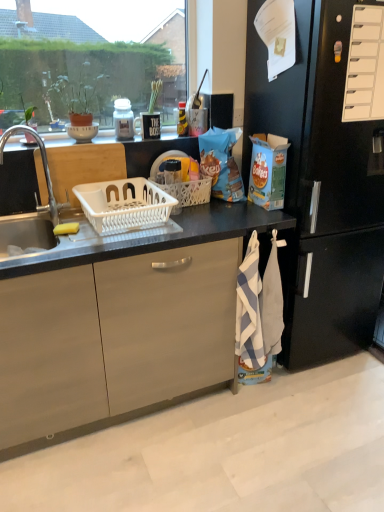
Question: Could you tell me if silver metallic sink at left is facing blue striped towel at lower right?

Choices:
 (A) no
 (B) yes

Answer: (A)

Question: Considering the relative sizes of silver metallic sink at left and blue striped towel at lower right in the image provided, is silver metallic sink at left taller than blue striped towel at lower right?

Choices:
 (A) yes
 (B) no

Answer: (B)

Question: Considering the relative sizes of silver metallic sink at left and blue striped towel at lower right in the image provided, is silver metallic sink at left thinner than blue striped towel at lower right?

Choices:
 (A) no
 (B) yes

Answer: (A)

Question: Can you see silver metallic sink at left touching blue striped towel at lower right?

Choices:
 (A) yes
 (B) no

Answer: (B)

Question: Does silver metallic sink at left lie behind blue striped towel at lower right?

Choices:
 (A) no
 (B) yes

Answer: (A)

Question: Relative to clear glass window at upper left, is blue striped towel at lower right in front or behind?

Choices:
 (A) behind
 (B) front

Answer: (B)

Question: In the image, is blue striped towel at lower right on the left side or the right side of clear glass window at upper left?

Choices:
 (A) left
 (B) right

Answer: (B)

Question: From the image's perspective, is blue striped towel at lower right above or below clear glass window at upper left?

Choices:
 (A) below
 (B) above

Answer: (A)

Question: Based on their sizes in the image, would you say blue striped towel at lower right is bigger or smaller than clear glass window at upper left?

Choices:
 (A) big
 (B) small

Answer: (B)

Question: Looking at their shapes, would you say white plastic basket at center, marked as the 1th picnic basket in a right-to-left arrangement, is wider or thinner than silver metallic sink at left?

Choices:
 (A) thin
 (B) wide

Answer: (A)

Question: In the image, is white plastic basket at center, marked as the second picnic basket in a left-to-right arrangement, on the left side or the right side of silver metallic sink at left?

Choices:
 (A) left
 (B) right

Answer: (B)

Question: From the image's perspective, relative to silver metallic sink at left, is white plastic basket at center, marked as the 1th picnic basket in a right-to-left arrangement, above or below?

Choices:
 (A) above
 (B) below

Answer: (B)

Question: Looking at the image, does white plastic basket at center, marked as the second picnic basket in a left-to-right arrangement, seem bigger or smaller compared to silver metallic sink at left?

Choices:
 (A) big
 (B) small

Answer: (B)

Question: Is point (77, 81) positioned closer to the camera than point (71, 138)?

Choices:
 (A) closer
 (B) farther

Answer: (A)

Question: From the image's perspective, relative to wooden cutting board at upper center, is clear glass window at upper left above or below?

Choices:
 (A) above
 (B) below

Answer: (A)